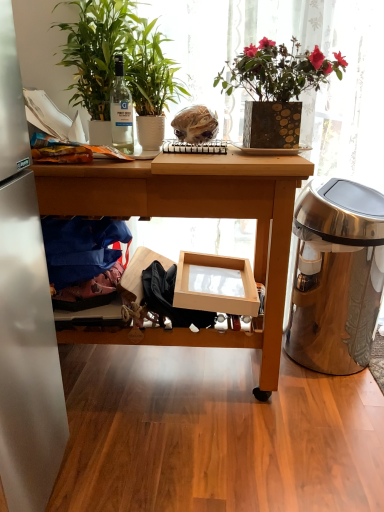
Locate an element on the screen. The height and width of the screenshot is (512, 384). free space in front of wooden desk at center is located at coordinates (173, 456).